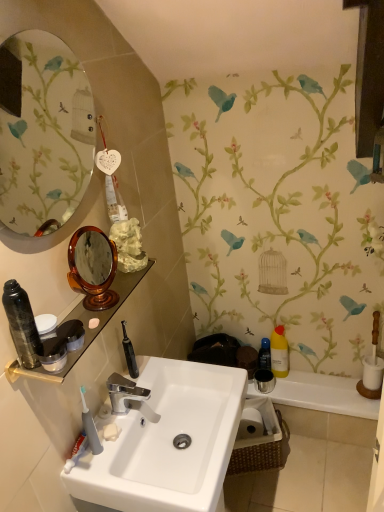
Question: Is oval glass mirror at upper left wider than yellow translucent bottle at right, arranged as the second toiletry when viewed from the back?

Choices:
 (A) no
 (B) yes

Answer: (B)

Question: Is oval glass mirror at upper left to the right of yellow translucent bottle at right, arranged as the second toiletry when viewed from the back, from the viewer's perspective?

Choices:
 (A) no
 (B) yes

Answer: (A)

Question: Does oval glass mirror at upper left have a lesser height compared to yellow translucent bottle at right, arranged as the second toiletry when viewed from the back?

Choices:
 (A) no
 (B) yes

Answer: (A)

Question: Does oval glass mirror at upper left come in front of yellow translucent bottle at right, arranged as the second toiletry when viewed from the back?

Choices:
 (A) no
 (B) yes

Answer: (B)

Question: Does oval glass mirror at upper left turn towards yellow translucent bottle at right, arranged as the 1th toiletry when viewed from the right?

Choices:
 (A) no
 (B) yes

Answer: (A)

Question: Considering the relative sizes of oval glass mirror at upper left and yellow translucent bottle at right, the 4th toiletry when ordered from left to right, in the image provided, is oval glass mirror at upper left bigger than yellow translucent bottle at right, the 4th toiletry when ordered from left to right,?

Choices:
 (A) no
 (B) yes

Answer: (B)

Question: From a real-world perspective, is white glossy sink at center physically above gray rubber toothbrush at lower left?

Choices:
 (A) yes
 (B) no

Answer: (B)

Question: From the image's perspective, is white glossy sink at center under gray rubber toothbrush at lower left?

Choices:
 (A) no
 (B) yes

Answer: (B)

Question: Is white glossy sink at center shorter than gray rubber toothbrush at lower left?

Choices:
 (A) no
 (B) yes

Answer: (A)

Question: Is the position of white glossy sink at center less distant than that of gray rubber toothbrush at lower left?

Choices:
 (A) no
 (B) yes

Answer: (B)

Question: Is white glossy sink at center further to camera compared to gray rubber toothbrush at lower left?

Choices:
 (A) no
 (B) yes

Answer: (A)

Question: Can you confirm if white glossy sink at center is bigger than gray rubber toothbrush at lower left?

Choices:
 (A) no
 (B) yes

Answer: (B)

Question: From a real-world perspective, is transparent plastic bottle at lower right, the 2th toiletry when ordered from right to left, physically above yellow translucent bottle at right, acting as the 3th toiletry starting from the front?

Choices:
 (A) no
 (B) yes

Answer: (A)